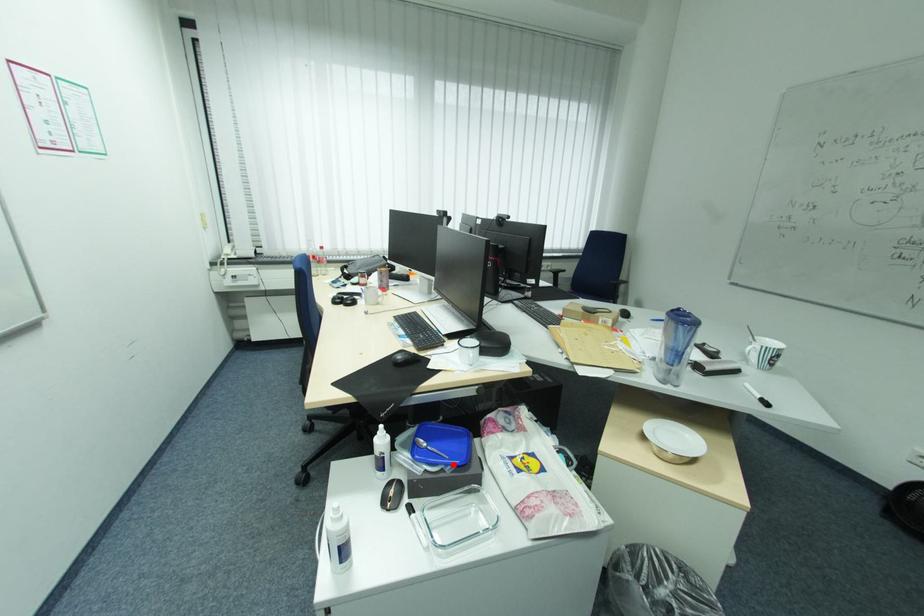
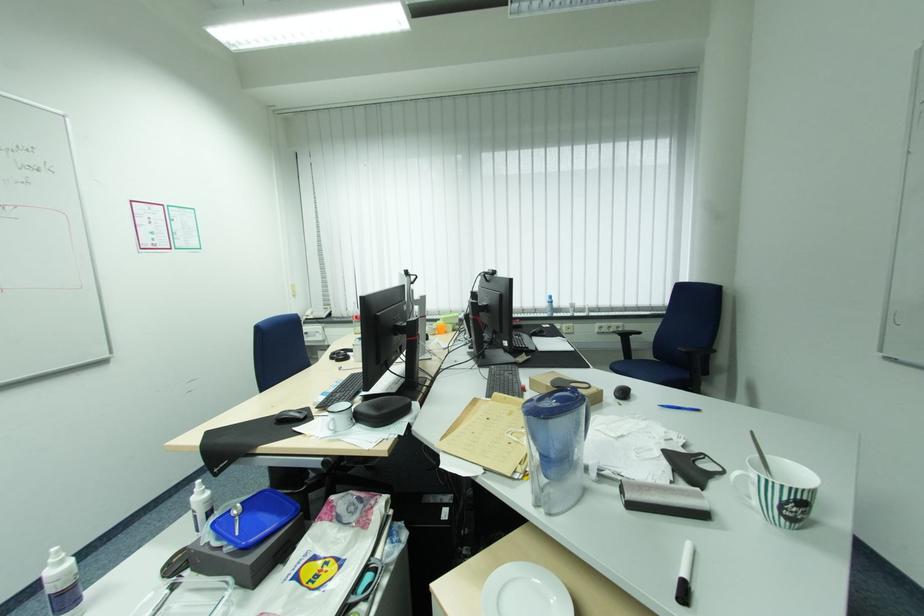
Where in the second image is the point corresponding to the highlighted location from the first image?

(237, 543)